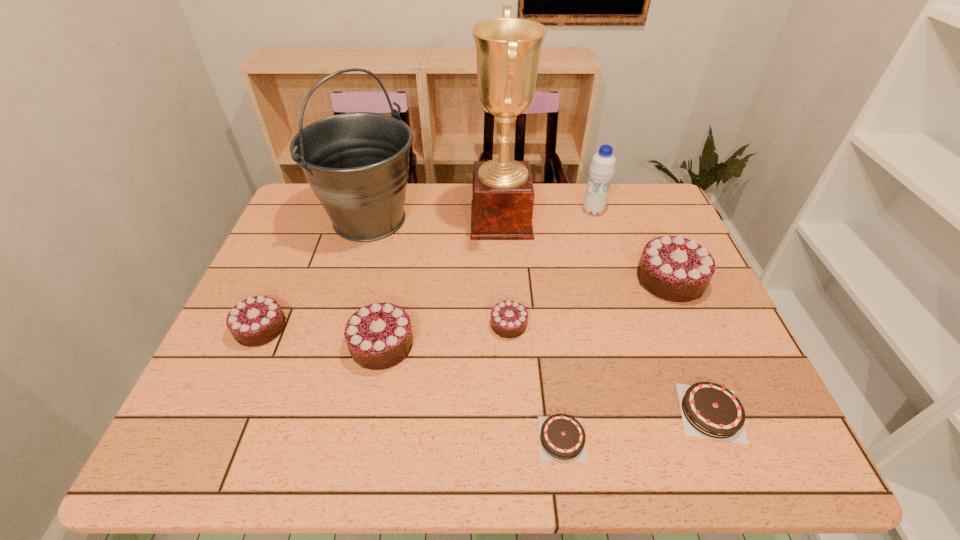
You are a GUI agent. You are given a task and a screenshot of the screen. Output one action in this format:
    pyautogui.click(x=<x>, y=<y>)
    Task: Click on the chocolate cake that is the nearest to the fourth tallest object
    Image resolution: width=960 pixels, height=540 pixels.
    Given the screenshot: What is the action you would take?
    pyautogui.click(x=293, y=436)

I want to click on the second closest chocolate chocolate cake to the trophy cup, so click(x=627, y=309).

Identify the location of chocolate chocolate cake that is the closest one to the blue water bottle. The height and width of the screenshot is (540, 960). (627, 309).

This screenshot has height=540, width=960. I want to click on vacant space that satisfies the following two spatial constraints: 1. on the plaque of the shortest chocolate cake; 2. on the right side of the trophy cup, so click(x=514, y=438).

Locate an element on the screen. vacant area in the image that satisfies the following two spatial constraints: 1. on the back side of the second biggest chocolate chocolate cake; 2. on the right side of the water bottle is located at coordinates (407, 211).

Locate an element on the screen. Image resolution: width=960 pixels, height=540 pixels. vacant space that satisfies the following two spatial constraints: 1. on the back side of the sixth nearest object; 2. on the left side of the shortest chocolate cake is located at coordinates (540, 279).

Identify the location of free location that satisfies the following two spatial constraints: 1. on the back side of the rightmost chocolate chocolate cake; 2. on the left side of the seventh tallest object. The image size is (960, 540). (506, 279).